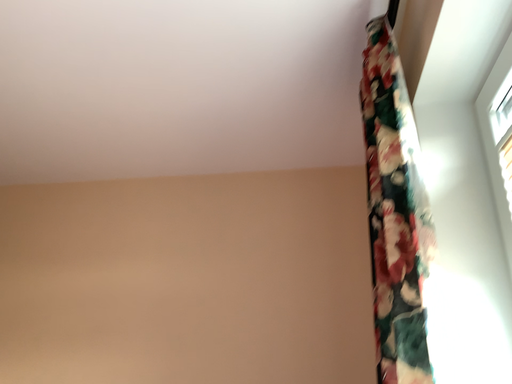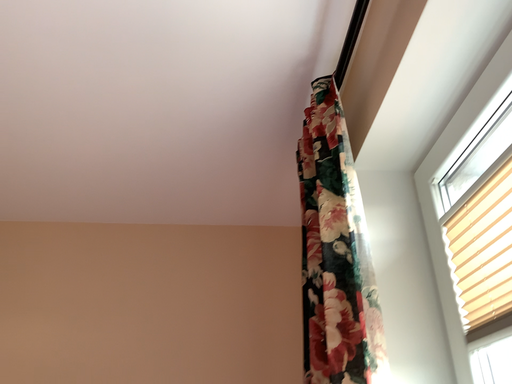
Question: Which way did the camera rotate in the video?

Choices:
 (A) rotated upward
 (B) rotated downward

Answer: (A)